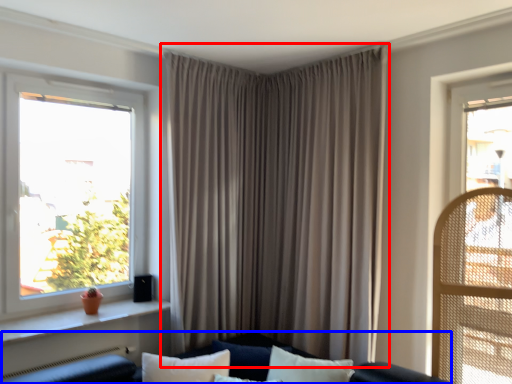
Question: Which object appears farthest to the camera in this image, curtain (highlighted by a red box) or couch (highlighted by a blue box)?

Choices:
 (A) curtain
 (B) couch

Answer: (A)